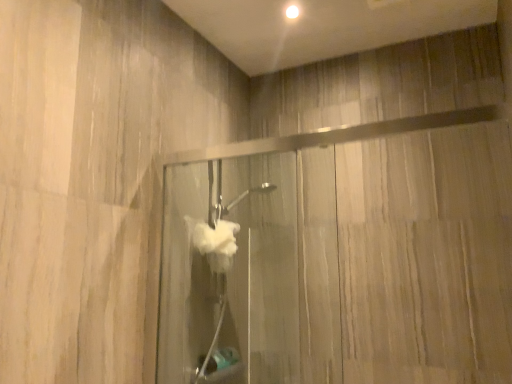
Question: Considering the positions of translucent glass shower door at center and transparent glass door at upper right in the image, is translucent glass shower door at center taller or shorter than transparent glass door at upper right?

Choices:
 (A) tall
 (B) short

Answer: (A)

Question: Is point (289, 168) positioned closer to the camera than point (435, 268)?

Choices:
 (A) farther
 (B) closer

Answer: (A)

Question: From a real-world perspective, is translucent glass shower door at center physically located above or below transparent glass door at upper right?

Choices:
 (A) below
 (B) above

Answer: (A)

Question: Is point (496, 137) closer or farther from the camera than point (193, 274)?

Choices:
 (A) closer
 (B) farther

Answer: (A)

Question: Considering the positions of transparent glass door at upper right and translucent glass shower door at center in the image, is transparent glass door at upper right bigger or smaller than translucent glass shower door at center?

Choices:
 (A) big
 (B) small

Answer: (B)

Question: Is transparent glass door at upper right spatially inside translucent glass shower door at center, or outside of it?

Choices:
 (A) inside
 (B) outside

Answer: (B)

Question: Considering the positions of transparent glass door at upper right and translucent glass shower door at center in the image, is transparent glass door at upper right taller or shorter than translucent glass shower door at center?

Choices:
 (A) short
 (B) tall

Answer: (A)